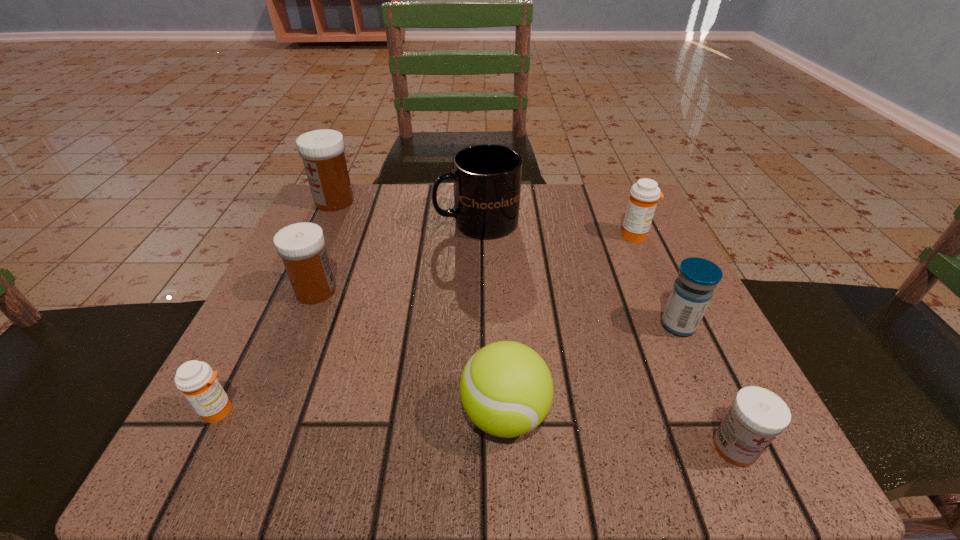
Identify the location of free spot between the nearer orange medicine and the blue medicine. (448, 368).

Identify the location of free space between the tallest medicine and the nearest white medicine. The image size is (960, 540). (535, 324).

This screenshot has width=960, height=540. Find the location of `free spot between the right orange medicine and the smallest white medicine`. free spot between the right orange medicine and the smallest white medicine is located at coordinates (685, 341).

This screenshot has width=960, height=540. Identify the location of free space between the smallest white medicine and the farther orange medicine. (685, 341).

Locate an element on the screen. This screenshot has height=540, width=960. vacant space that is in between the blue medicine and the left orange medicine is located at coordinates (448, 368).

Locate an element on the screen. This screenshot has width=960, height=540. object that is the sixth closest to the left orange medicine is located at coordinates (692, 291).

Point out which object is positioned as the nearest to the smaller orange medicine. Please provide its 2D coordinates. Your answer should be formatted as a tuple, i.e. [(x, y)], where the tuple contains the x and y coordinates of a point satisfying the conditions above.

[(301, 246)]

This screenshot has height=540, width=960. I want to click on medicine that stands as the second closest to the fourth farthest medicine, so click(x=643, y=198).

Locate which medicine is the third closest to the right orange medicine. Please provide its 2D coordinates. Your answer should be formatted as a tuple, i.e. [(x, y)], where the tuple contains the x and y coordinates of a point satisfying the conditions above.

[(301, 246)]

This screenshot has width=960, height=540. Find the location of `white medicine that stands as the third closest to the green tennis ball`. white medicine that stands as the third closest to the green tennis ball is located at coordinates (322, 151).